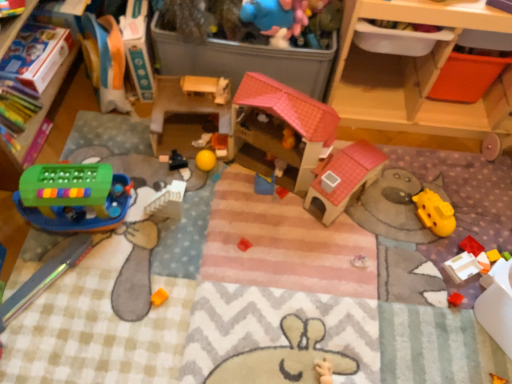
At what (x,y) coordinates should I click in order to perform the action: click on vacant area situated to the left side of yellow rubber ball at center, the fifth toy in the right-to-left sequence. Please return your answer as a coordinate pair (x, y). Looking at the image, I should click on (147, 170).